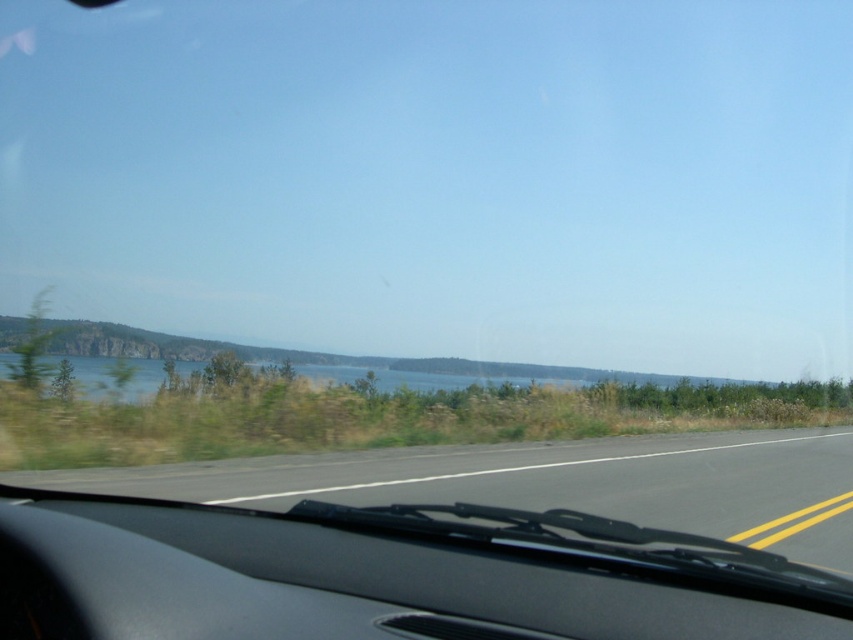
Who is taller, black matte dashboard at center or black asphalt road at center?

Standing taller between the two is black asphalt road at center.

Is black matte dashboard at center wider than black asphalt road at center?

No.

Between point (167, 588) and point (757, 529), which one is positioned in front?

Point (167, 588)

You are a GUI agent. You are given a task and a screenshot of the screen. Output one action in this format:
    pyautogui.click(x=<x>, y=<y>)
    Task: Click on the black matte dashboard at center
    This screenshot has width=853, height=640.
    Given the screenshot: What is the action you would take?
    pyautogui.click(x=386, y=573)